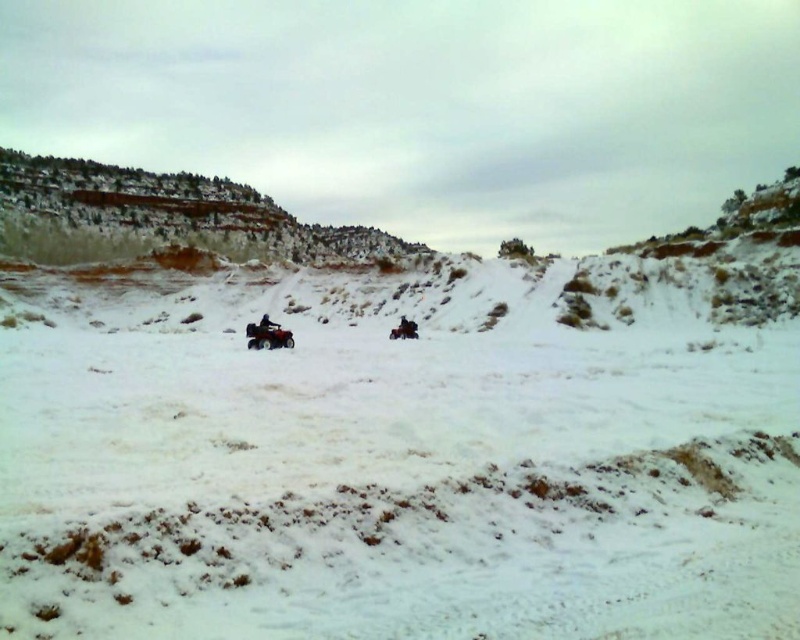
Between point (117, 182) and point (248, 340), which one is positioned in front?

Point (248, 340) is more forward.

Locate an element on the screen. This screenshot has height=640, width=800. rustic stone cliff at upper left is located at coordinates click(168, 212).

Image resolution: width=800 pixels, height=640 pixels. What do you see at coordinates (168, 212) in the screenshot?
I see `rustic stone cliff at upper left` at bounding box center [168, 212].

Locate an element on the screen. Image resolution: width=800 pixels, height=640 pixels. rustic stone cliff at upper left is located at coordinates (168, 212).

Can you confirm if matte red snowmobile at center is positioned to the right of blue fabric jacket at center?

Correct, you'll find matte red snowmobile at center to the right of blue fabric jacket at center.

Is point (270, 323) less distant than point (266, 316)?

That is True.

Identify the location of matte red snowmobile at center. (268, 336).

Which is below, rustic stone cliff at upper left or blue fabric jacket at center?

Positioned lower is blue fabric jacket at center.

At what (x,y) coordinates should I click in order to perform the action: click on rustic stone cliff at upper left. Please return your answer as a coordinate pair (x, y). This screenshot has width=800, height=640. Looking at the image, I should click on (168, 212).